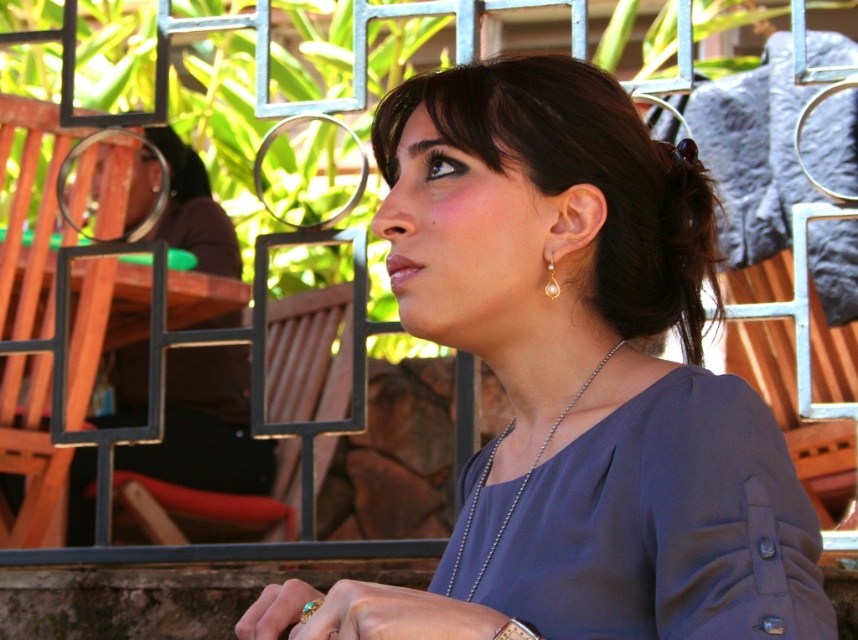
Question: Which object is positioned closest to the silver metallic bracelet at lower center?

Choices:
 (A) matte black shirt at upper center
 (B) matte purple blouse at center

Answer: (B)

Question: Is matte blue dress at center further to the viewer compared to silver metallic chain at center?

Choices:
 (A) no
 (B) yes

Answer: (A)

Question: Considering the real-world distances, which object is farthest from the matte blue dress at center?

Choices:
 (A) pearl gold earring at right
 (B) metallic wood chair at center

Answer: (B)

Question: Is matte purple blouse at center below metallic wood chair at center?

Choices:
 (A) no
 (B) yes

Answer: (A)

Question: Estimate the real-world distances between objects in this image. Which object is farther from the matte purple blouse at center?

Choices:
 (A) matte black shirt at upper center
 (B) silver metallic bracelet at lower center
 (C) silver metallic chain at center
 (D) metallic wood chair at center

Answer: (D)

Question: Is matte black shirt at upper center smaller than silver metallic bracelet at lower center?

Choices:
 (A) yes
 (B) no

Answer: (B)